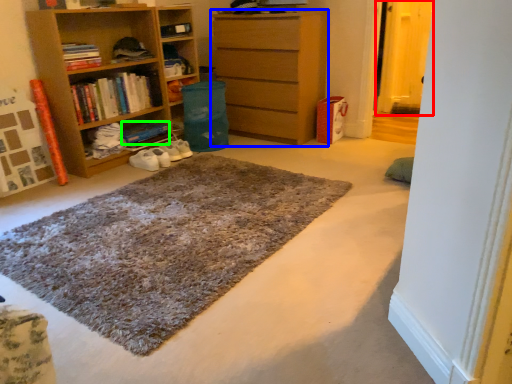
Question: Which object is the farthest from glass door (highlighted by a red box)? Choose among these: chest of drawers (highlighted by a blue box) or book (highlighted by a green box).

Choices:
 (A) chest of drawers
 (B) book

Answer: (B)